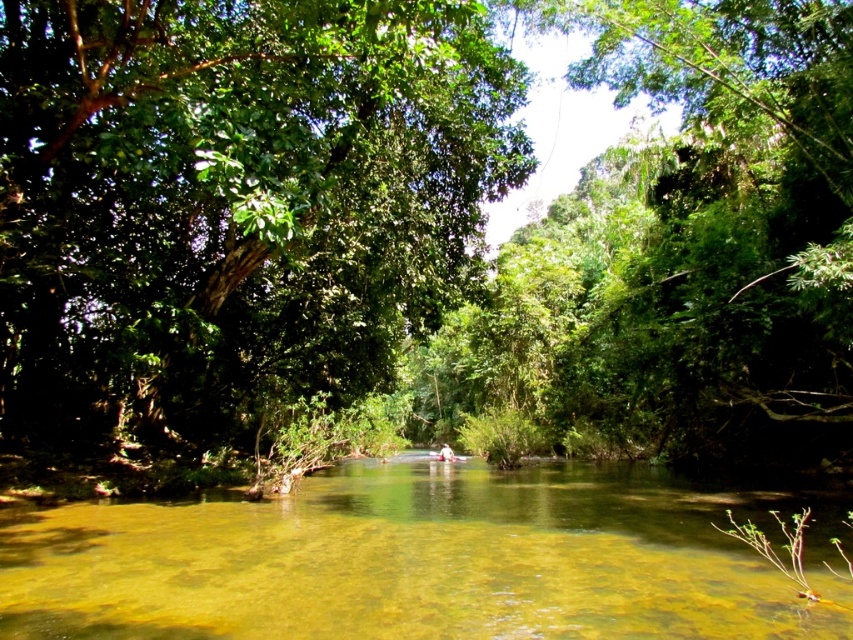
Question: Is green leafy tree at center positioned in front of clear water at center?

Choices:
 (A) no
 (B) yes

Answer: (A)

Question: Among these points, which one is farthest from the camera?

Choices:
 (A) (502, 513)
 (B) (439, 458)

Answer: (B)

Question: Which point is closer to the camera?

Choices:
 (A) (425, 182)
 (B) (448, 454)

Answer: (A)

Question: Which point is closer to the camera?

Choices:
 (A) (387, 381)
 (B) (96, 524)

Answer: (B)

Question: Is green leafy tree at center below clear water at center?

Choices:
 (A) no
 (B) yes

Answer: (A)

Question: Is clear water at center thinner than light brown wooden canoe at center?

Choices:
 (A) no
 (B) yes

Answer: (A)